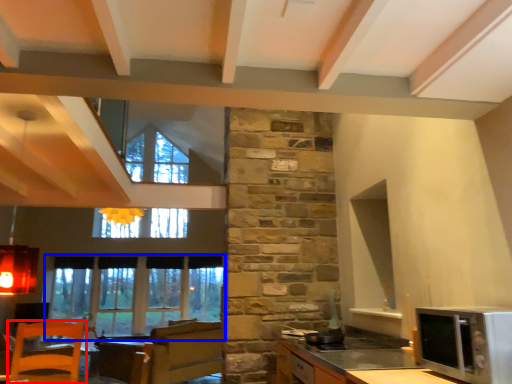
Question: Which of the following is the farthest to the observer, chair (highlighted by a red box) or window (highlighted by a blue box)?

Choices:
 (A) chair
 (B) window

Answer: (B)